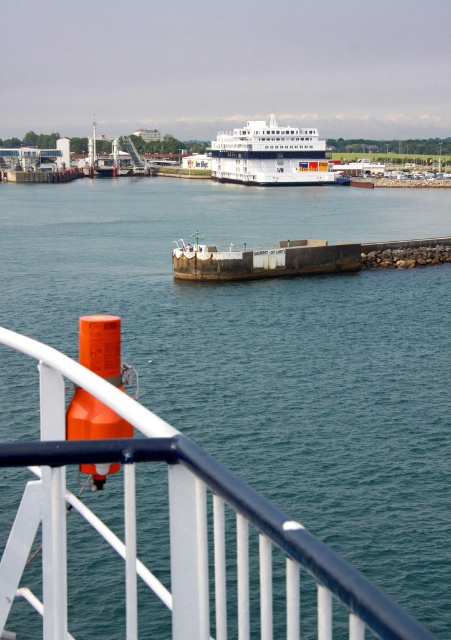
You are standing on the deck of the ship and want to take a photo of the white glossy cruise ship at center. To avoid including the white glossy rail at lower left in your photo, should you adjust your camera angle upwards or downwards?

The white glossy rail at lower left is below the white glossy cruise ship at center. To avoid including the rail, you should adjust your camera angle upwards to focus solely on the cruise ship.